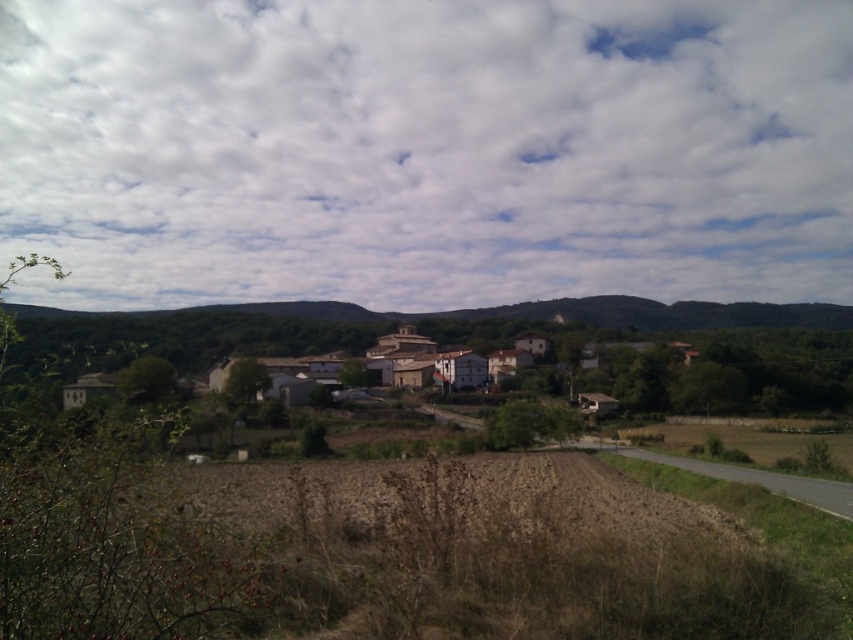
Question: Can you confirm if white fluffy clouds at upper center is positioned to the right of white stucco village at center?

Choices:
 (A) yes
 (B) no

Answer: (A)

Question: Which of the following is the closest to the observer?

Choices:
 (A) white fluffy clouds at upper center
 (B) white stucco village at center

Answer: (B)

Question: Is white fluffy clouds at upper center positioned before white stucco village at center?

Choices:
 (A) yes
 (B) no

Answer: (B)

Question: Which object appears closest to the camera in this image?

Choices:
 (A) white stucco village at center
 (B) white fluffy clouds at upper center

Answer: (A)

Question: Is white fluffy clouds at upper center bigger than white stucco village at center?

Choices:
 (A) no
 (B) yes

Answer: (B)

Question: Which point is closer to the camera?

Choices:
 (A) white stucco village at center
 (B) white fluffy clouds at upper center

Answer: (A)